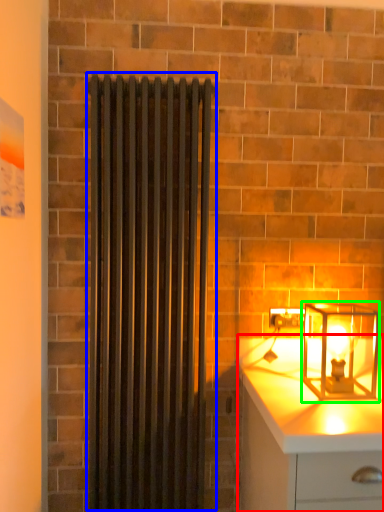
Question: Which object is the closest to the chest of drawers (highlighted by a red box)? Choose among these: shower curtain (highlighted by a blue box) or lamp (highlighted by a green box).

Choices:
 (A) shower curtain
 (B) lamp

Answer: (B)